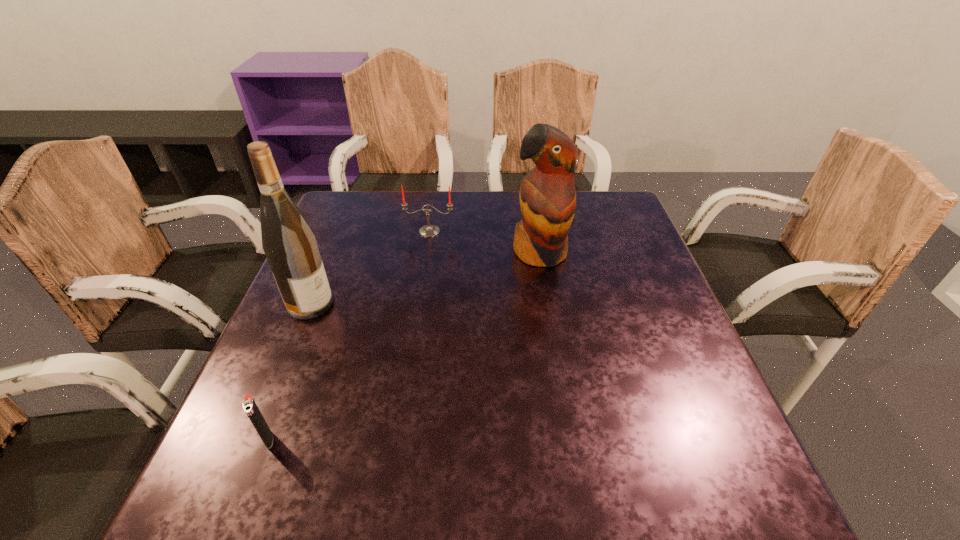
This screenshot has height=540, width=960. Identify the location of object that is at the far edge. [428, 230].

In order to click on wine bottle located in the left edge section of the desktop in this screenshot , I will do `click(289, 243)`.

I want to click on igniter at the left edge, so click(249, 405).

What are the coordinates of `vacant area at the far edge of the desktop` in the screenshot? It's located at (454, 191).

Locate an element on the screen. The width and height of the screenshot is (960, 540). free region at the near edge of the desktop is located at coordinates (328, 469).

Where is `vacant space at the left edge of the desktop`? vacant space at the left edge of the desktop is located at coordinates (365, 241).

The height and width of the screenshot is (540, 960). Identify the location of vacant position at the right edge of the desktop. (633, 259).

The height and width of the screenshot is (540, 960). What are the coordinates of `vacant space at the far left corner of the desktop` in the screenshot? It's located at (360, 233).

In the image, there is a desktop. Where is `free space at the near left corner`? This screenshot has width=960, height=540. free space at the near left corner is located at coordinates (221, 479).

Image resolution: width=960 pixels, height=540 pixels. In order to click on vacant area at the far right corner in this screenshot , I will do `click(614, 232)`.